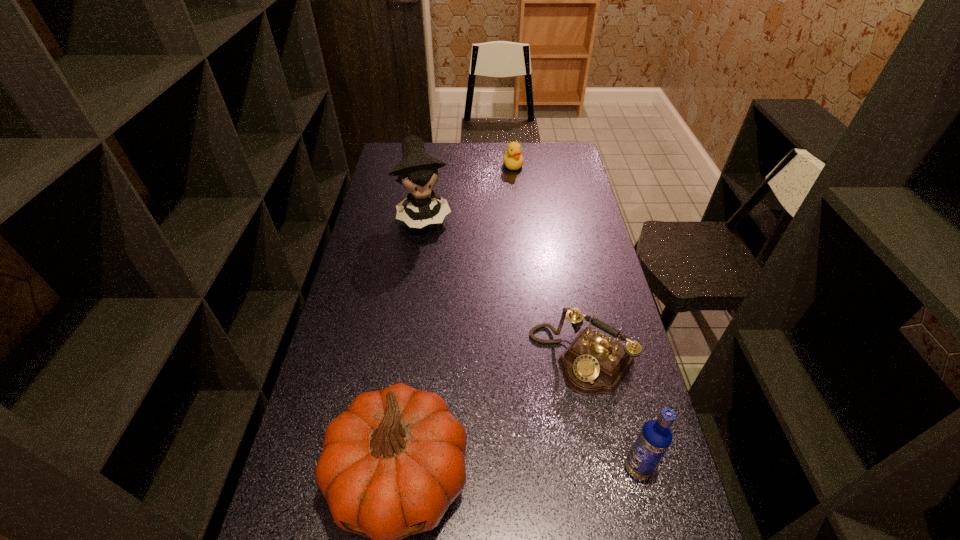
Locate an element on the screen. The image size is (960, 540). vacant area situated 0.380m at the face of the second farthest object is located at coordinates (457, 310).

What are the coordinates of `free space located 0.090m on the dial of the third farthest object` in the screenshot? It's located at (536, 410).

Where is `blank area located 0.310m on the dial of the third farthest object`? Image resolution: width=960 pixels, height=540 pixels. blank area located 0.310m on the dial of the third farthest object is located at coordinates (484, 477).

Identify the location of free region located on the dial of the third farthest object. Image resolution: width=960 pixels, height=540 pixels. (487, 473).

Where is `vacant region located 0.220m on the face of the farthest object`? The height and width of the screenshot is (540, 960). vacant region located 0.220m on the face of the farthest object is located at coordinates click(517, 202).

You are a GUI agent. You are given a task and a screenshot of the screen. Output one action in this format:
    pyautogui.click(x=<x>, y=<y>)
    Task: Click on the free space located on the face of the farthest object
    The width and height of the screenshot is (960, 540).
    Given the screenshot: What is the action you would take?
    pyautogui.click(x=515, y=179)

You are a GUI agent. You are given a task and a screenshot of the screen. Output one action in this format:
    pyautogui.click(x=<x>, y=<y>)
    Task: Click on the vacant area situated 0.270m on the face of the farthest object
    This screenshot has width=960, height=540.
    Given the screenshot: What is the action you would take?
    pyautogui.click(x=518, y=209)

Find the location of `object that is at the far edge`. object that is at the far edge is located at coordinates (513, 159).

I want to click on object that is at the left edge, so click(417, 171).

In order to click on vodka present at the right edge in this screenshot , I will do `click(655, 437)`.